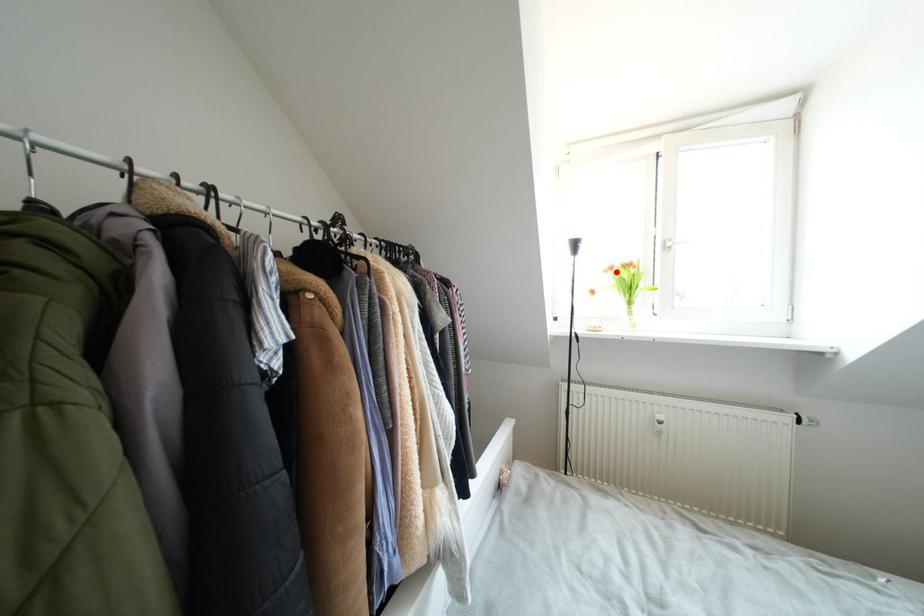
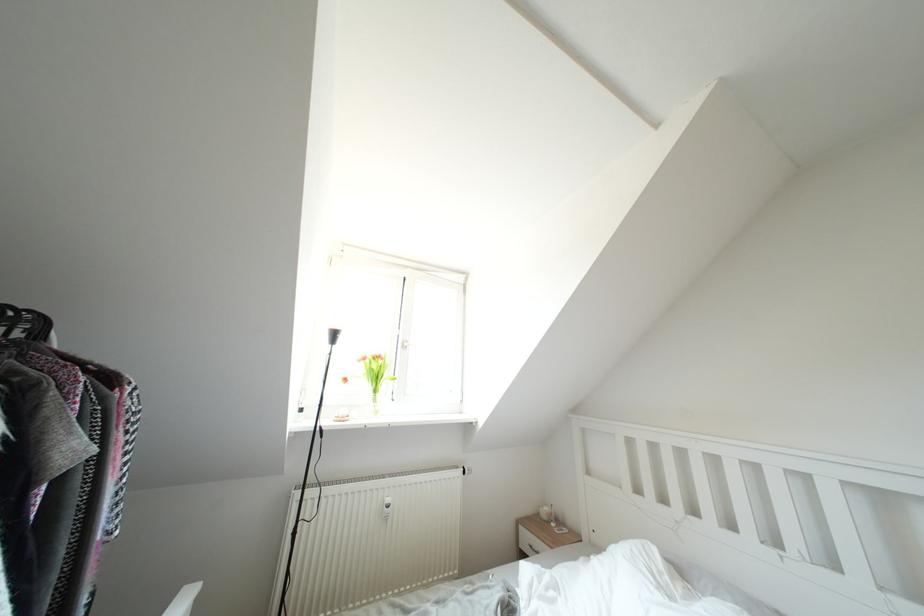
Where in the second image is the point corresponding to the highlighted location from the first image?

(370, 363)